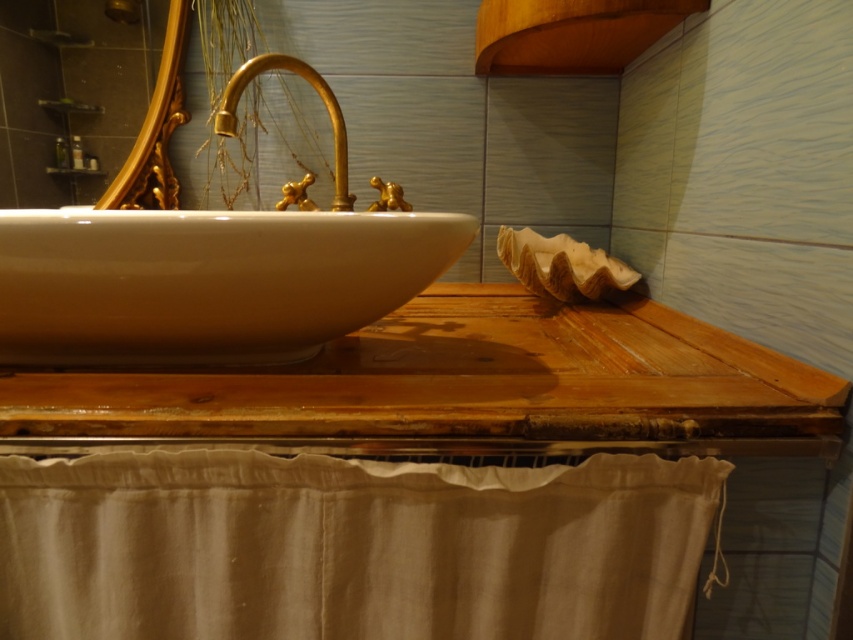
From the picture: Does beige cotton curtain at lower center have a smaller size compared to white glossy sink at center?

Correct, beige cotton curtain at lower center occupies less space than white glossy sink at center.

Does point (155, 637) come farther from viewer compared to point (296, 356)?

No.

The width and height of the screenshot is (853, 640). Describe the element at coordinates (349, 547) in the screenshot. I see `beige cotton curtain at lower center` at that location.

The image size is (853, 640). In order to click on beige cotton curtain at lower center in this screenshot , I will do `click(349, 547)`.

Is wooden counter top at center positioned before white glossy sink at center?

Yes, it is in front of white glossy sink at center.

Between point (47, 435) and point (3, 330), which one is positioned in front?

Point (47, 435) is in front.

Identify the location of wooden counter top at center. (461, 388).

Which is more to the right, white glossy sink at center or wooden lampshade at upper right?

Positioned to the right is wooden lampshade at upper right.

Find the location of `white glossy sink at center`. white glossy sink at center is located at coordinates (212, 273).

The width and height of the screenshot is (853, 640). Find the location of `white glossy sink at center`. white glossy sink at center is located at coordinates (212, 273).